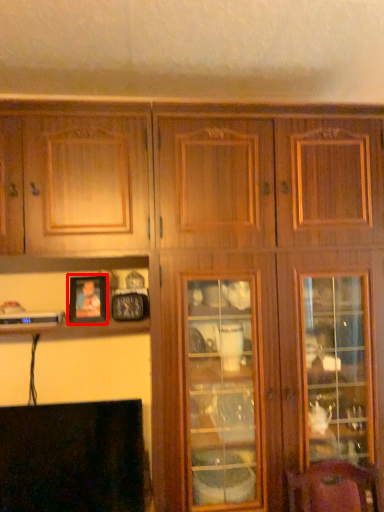
Question: From the image, what is the correct spatial relationship of picture frame (annotated by the red box) in relation to fireplace?

Choices:
 (A) right
 (B) left

Answer: (A)